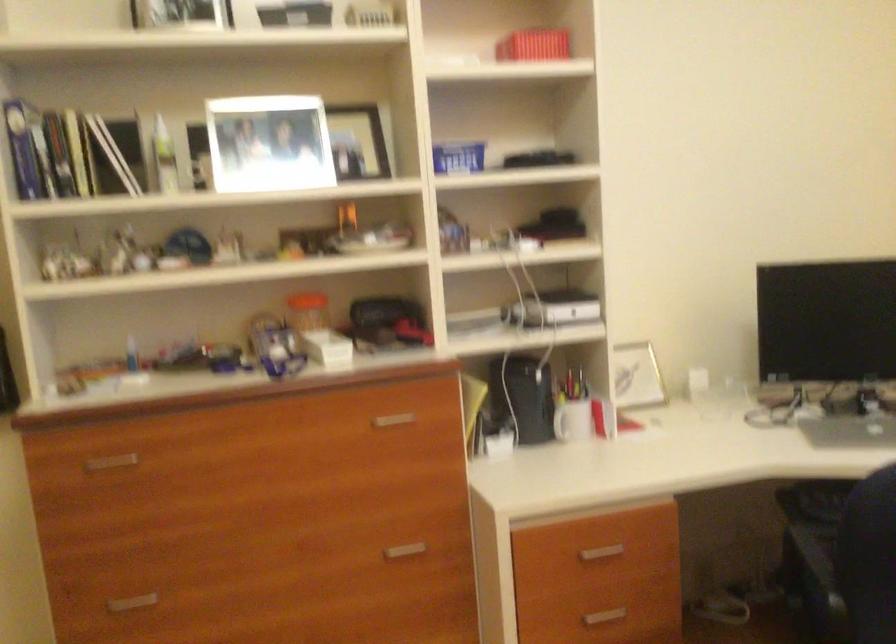
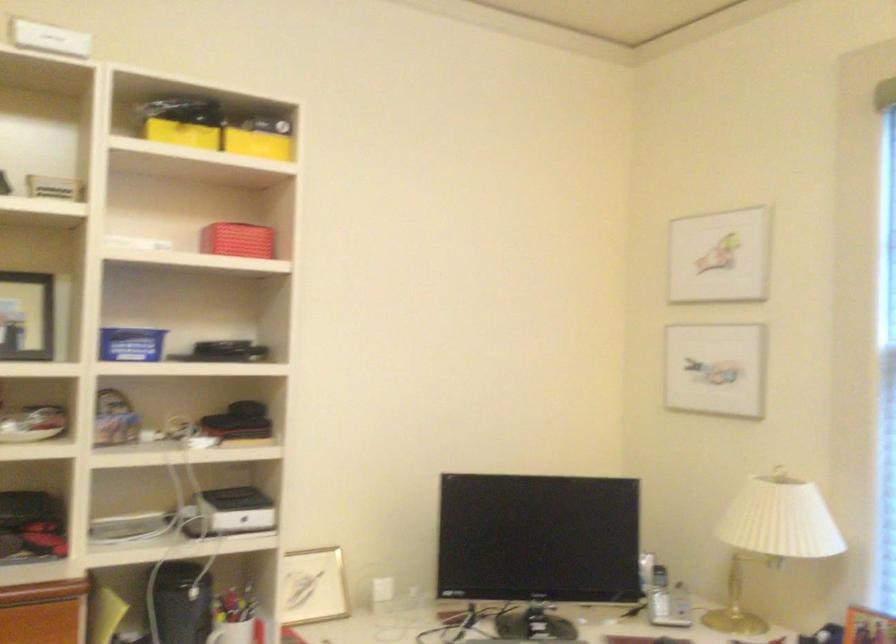
Question: Which direction would the cameraman need to move to produce the second image? Reply with the corresponding letter.

Choices:
 (A) Left
 (B) Right
 (C) Forward
 (D) Backward

Answer: (B)